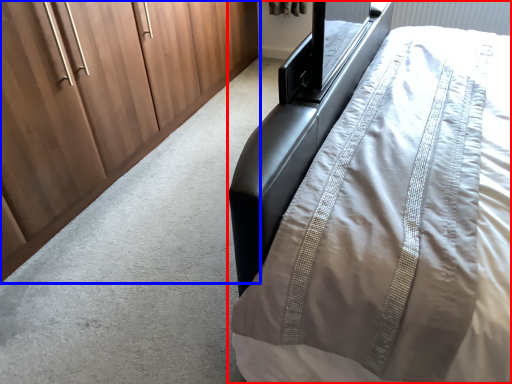
Question: Which point is further to the camera, bed (highlighted by a red box) or cupboard (highlighted by a blue box)?

Choices:
 (A) bed
 (B) cupboard

Answer: (B)